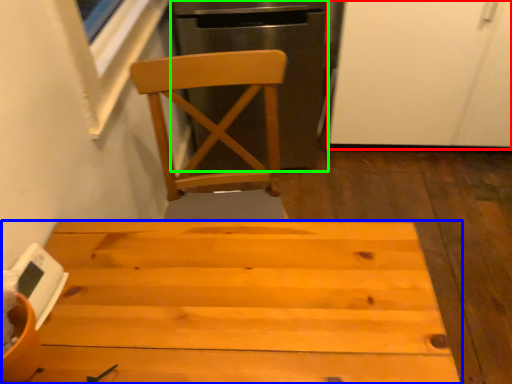
Question: Estimate the real-world distances between objects in this image. Which object is closer to screen door (highlighted by a red box), table (highlighted by a blue box) or leftover (highlighted by a green box)?

Choices:
 (A) table
 (B) leftover

Answer: (B)